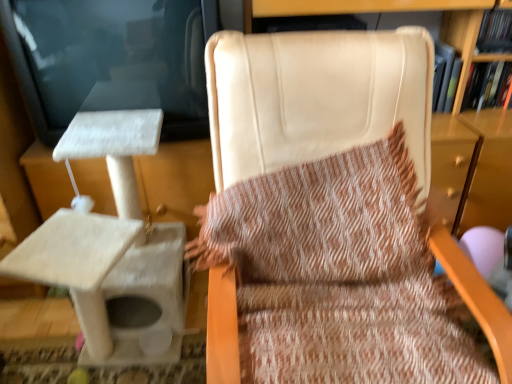
Measure the distance between point (482, 280) and camera.

39.29 inches.

What is the approximate width of white textured cat tree at left?

It is 73.15 centimeters.

Locate an element on the screen. This screenshot has height=384, width=512. hardcover book at upper right is located at coordinates (487, 85).

Are hardcover book at upper right and beige leather chair at center far apart?

That's not correct — hardcover book at upper right is a little close to beige leather chair at center.

Who is taller, hardcover book at upper right or beige leather chair at center?

With more height is beige leather chair at center.

From a real-world perspective, is hardcover book at upper right positioned over beige leather chair at center based on gravity?

Yes, from a real-world perspective, hardcover book at upper right is above beige leather chair at center.

Is point (484, 91) positioned before point (216, 379)?

No, it is not.

Which point is more distant from viewer, (162,227) or (293,76)?

Positioned behind is point (162,227).

Is white textured cat tree at left facing towards beige leather chair at center?

No.

Is white textured cat tree at left taller or shorter than beige leather chair at center?

white textured cat tree at left is shorter than beige leather chair at center.

Can you tell me how much white textured cat tree at left and beige leather chair at center differ in facing direction?

The facing directions of white textured cat tree at left and beige leather chair at center are 0.000508 degrees apart.

Is hardcover book at upper right at the back of beige leather chair at center?

beige leather chair at center does not have its back to hardcover book at upper right.

Based on the photo, considering the relative sizes of beige leather chair at center and hardcover book at upper right in the image provided, is beige leather chair at center smaller than hardcover book at upper right?

No, beige leather chair at center is not smaller than hardcover book at upper right.

From a real-world perspective, between beige leather chair at center and hardcover book at upper right, who is vertically lower?

beige leather chair at center, from a real-world perspective.

From the image's perspective, would you say beige leather chair at center is positioned over hardcover book at upper right?

No.

This screenshot has width=512, height=384. In order to click on table in front of the hardcover book at upper right in this screenshot , I will do `click(112, 283)`.

Are white textured cat tree at left and hardcover book at upper right beside each other?

No, white textured cat tree at left is not with hardcover book at upper right.

Which is more to the right, white textured cat tree at left or hardcover book at upper right?

hardcover book at upper right is more to the right.

In the scene shown: Who is bigger, white textured cat tree at left or hardcover book at upper right?

With larger size is white textured cat tree at left.

From the picture: Which of these two, hardcover book at upper right or white textured cat tree at left, stands shorter?

hardcover book at upper right.

Does hardcover book at upper right have a greater width compared to white textured cat tree at left?

No, hardcover book at upper right is not wider than white textured cat tree at left.

From the image's perspective, which one is positioned higher, hardcover book at upper right or white textured cat tree at left?

hardcover book at upper right, from the image's perspective.

From a real-world perspective, between hardcover book at upper right and white textured cat tree at left, who is vertically higher?

hardcover book at upper right.

Considering the relative positions of beige leather chair at center and white textured cat tree at left in the image provided, is beige leather chair at center to the right of white textured cat tree at left from the viewer's perspective?

Indeed, beige leather chair at center is positioned on the right side of white textured cat tree at left.

Looking at this image, is beige leather chair at center with white textured cat tree at left?

No, beige leather chair at center is not next to white textured cat tree at left.

Is beige leather chair at center looking in the opposite direction of white textured cat tree at left?

No.

Which point is more distant from viewer, [356,118] or [70,254]?

The point [70,254] is farther from the camera.

Find the location of a particular element. chair below the hardcover book at upper right (from the image's perspective) is located at coordinates (314, 101).

You are a GUI agent. You are given a task and a screenshot of the screen. Output one action in this format:
    pyautogui.click(x=<x>, y=<y>)
    Task: Click on the table on the left of beige leather chair at center
    
    Given the screenshot: What is the action you would take?
    coord(112,283)

From the image, which object appears to be farther from white textured cat tree at left, beige leather chair at center or hardcover book at upper right?

hardcover book at upper right.

From the image, which object appears to be farther from beige leather chair at center, hardcover book at upper right or white textured cat tree at left?

The object further to beige leather chair at center is hardcover book at upper right.

Looking at the image, which one is located closer to hardcover book at upper right, white textured cat tree at left or beige leather chair at center?

beige leather chair at center.

When comparing their distances from beige leather chair at center, does white textured cat tree at left or hardcover book at upper right seem further?

Based on the image, hardcover book at upper right appears to be further to beige leather chair at center.

When comparing their distances from hardcover book at upper right, does beige leather chair at center or white textured cat tree at left seem further?

The object further to hardcover book at upper right is white textured cat tree at left.

In the scene shown: Considering their positions, is hardcover book at upper right positioned further to white textured cat tree at left than beige leather chair at center?

hardcover book at upper right.

The image size is (512, 384). In order to click on chair between white textured cat tree at left and hardcover book at upper right in this screenshot , I will do `click(314, 101)`.